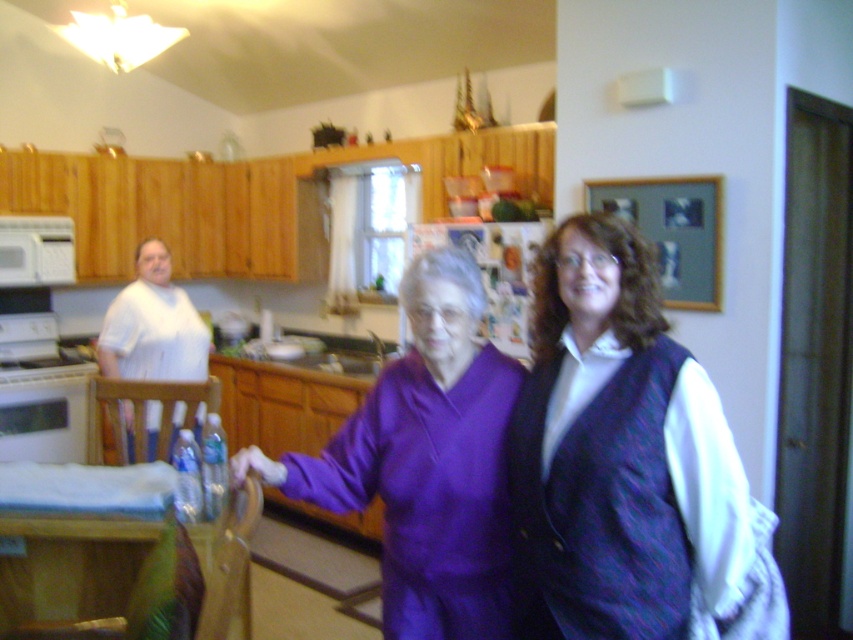
Is point (438, 579) more distant than point (80, 413)?

That is False.

Locate an element on the screen. The width and height of the screenshot is (853, 640). purple satin blouse at center is located at coordinates (425, 461).

Consider the image. Is white glossy stove at left further to camera compared to white matte microwave at left?

No, it is in front of white matte microwave at left.

The height and width of the screenshot is (640, 853). Identify the location of white glossy stove at left. (44, 396).

Locate an element on the screen. The image size is (853, 640). white glossy stove at left is located at coordinates (44, 396).

Can you confirm if purple fabric at center is positioned above purple satin blouse at center?

Correct, purple fabric at center is located above purple satin blouse at center.

Between purple fabric at center and purple satin blouse at center, which one is positioned higher?

purple fabric at center is higher up.

The height and width of the screenshot is (640, 853). Describe the element at coordinates (628, 464) in the screenshot. I see `purple fabric at center` at that location.

You are a GUI agent. You are given a task and a screenshot of the screen. Output one action in this format:
    pyautogui.click(x=<x>, y=<y>)
    Task: Click on the purple fabric at center
    This screenshot has height=640, width=853.
    Given the screenshot: What is the action you would take?
    pyautogui.click(x=628, y=464)